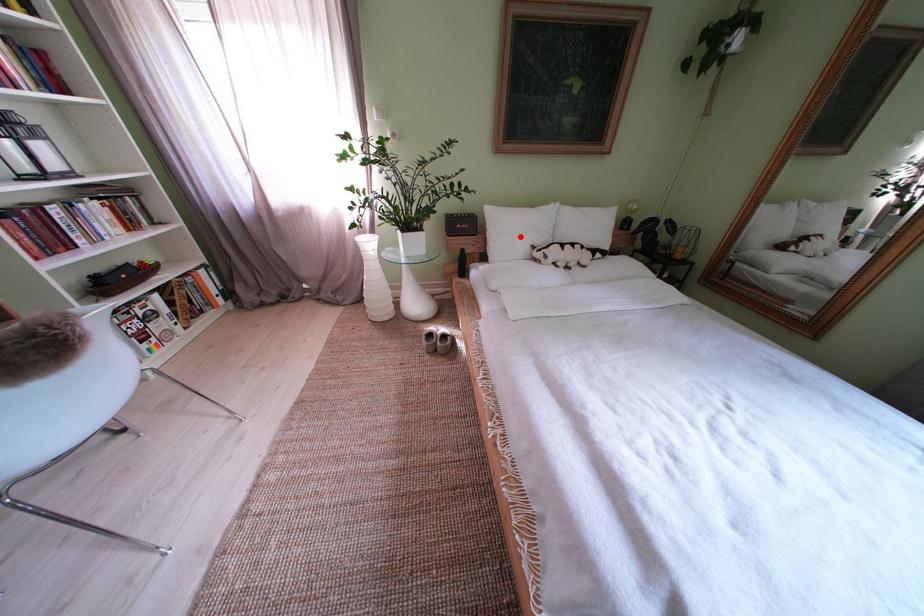
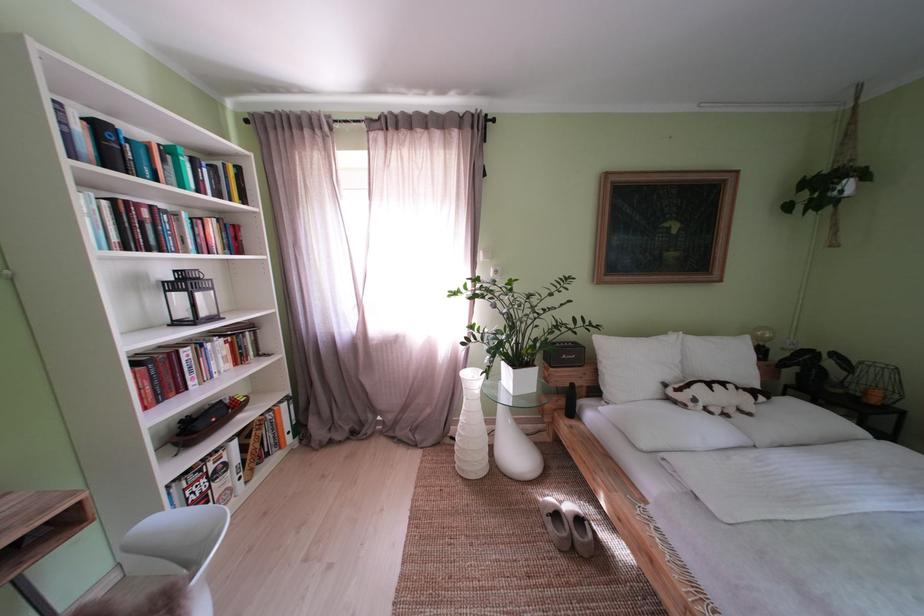
Find the pixel in the second image that matches the highlighted location in the first image.

(639, 369)